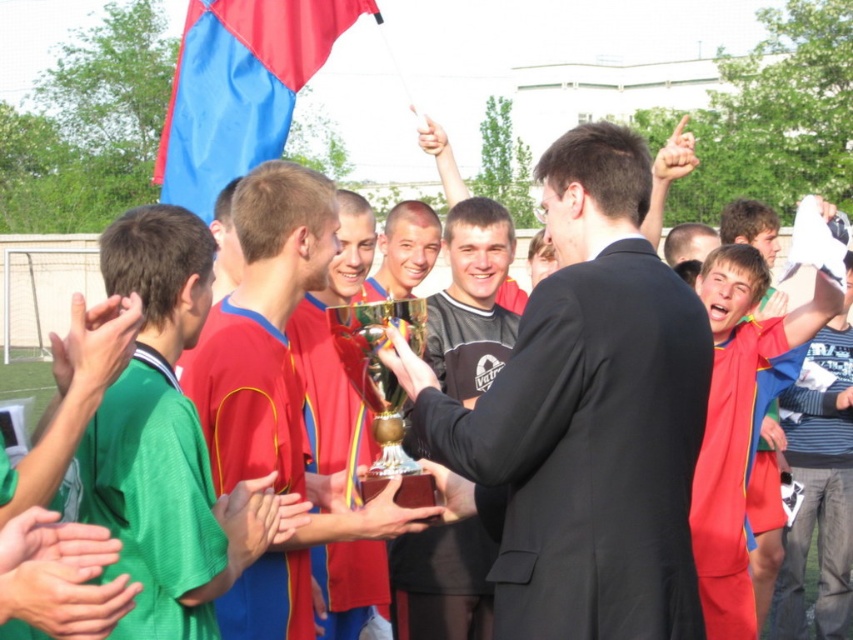
Who is lower down, green jersey at left or gold metallic trophy at center?

green jersey at left is below.

Who is positioned more to the left, green jersey at left or gold metallic trophy at center?

green jersey at left

Where is `green jersey at left`? The height and width of the screenshot is (640, 853). green jersey at left is located at coordinates (166, 438).

Find the location of a particular element. The height and width of the screenshot is (640, 853). green jersey at left is located at coordinates (166, 438).

Is matte black jersey at center below matte gold trophy at center?

No, matte black jersey at center is not below matte gold trophy at center.

Is matte black jersey at center shorter than matte gold trophy at center?

No.

Image resolution: width=853 pixels, height=640 pixels. In order to click on matte black jersey at center in this screenshot , I will do `click(471, 301)`.

Can you confirm if matte black jersey at center is shorter than green matte hand at lower left?

No, matte black jersey at center is not shorter than green matte hand at lower left.

Is point (431, 561) positioned in front of point (106, 362)?

No, (431, 561) is behind (106, 362).

Locate an element on the screen. matte black jersey at center is located at coordinates (471, 301).